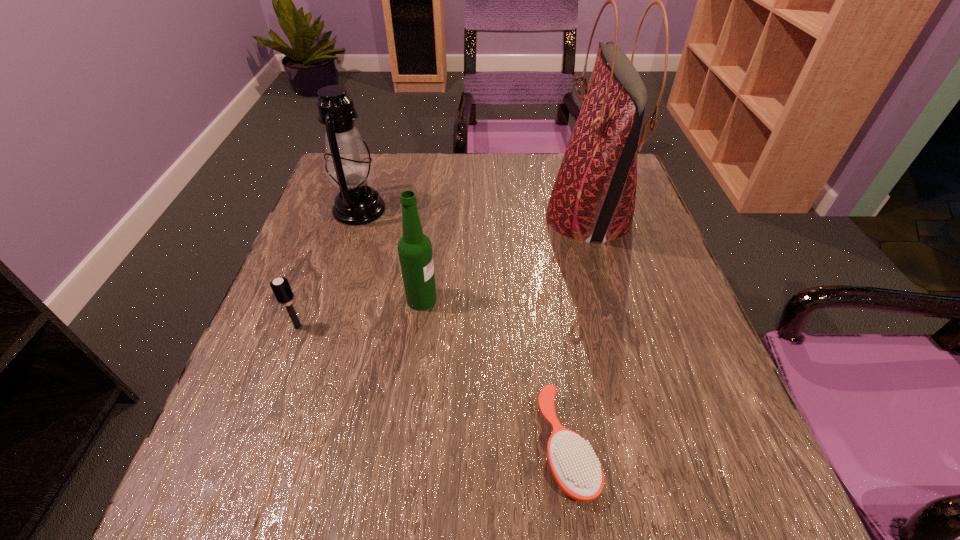
This screenshot has width=960, height=540. In order to click on object at the far right corner in this screenshot , I will do `click(593, 198)`.

Find the location of a particular element. This screenshot has width=960, height=540. vacant region at the far edge of the desktop is located at coordinates (473, 197).

The image size is (960, 540). Find the location of `vacant space at the left edge of the desktop`. vacant space at the left edge of the desktop is located at coordinates click(x=317, y=381).

I want to click on vacant space at the right edge of the desktop, so click(x=654, y=313).

This screenshot has height=540, width=960. In the image, there is a desktop. Identify the location of vacant space at the near right corner. (668, 462).

Identify the location of free space between the nearest object and the oil lamp. Image resolution: width=960 pixels, height=540 pixels. (463, 328).

This screenshot has width=960, height=540. What are the coordinates of `vacant space in between the oil lamp and the handbag` in the screenshot? It's located at (474, 214).

Where is `free space between the beer bottle and the oil lamp`? This screenshot has width=960, height=540. free space between the beer bottle and the oil lamp is located at coordinates (391, 254).

I want to click on empty space that is in between the tallest object and the third object from left to right, so click(x=505, y=259).

Identify the location of vacant area that lies between the second shortest object and the tallest object. (444, 272).